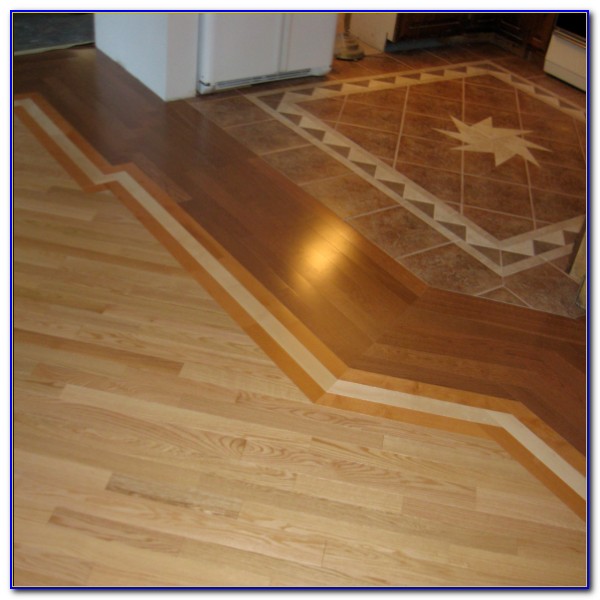
Locate an element on the screen. The image size is (600, 600). floor lamp base is located at coordinates (354, 51).